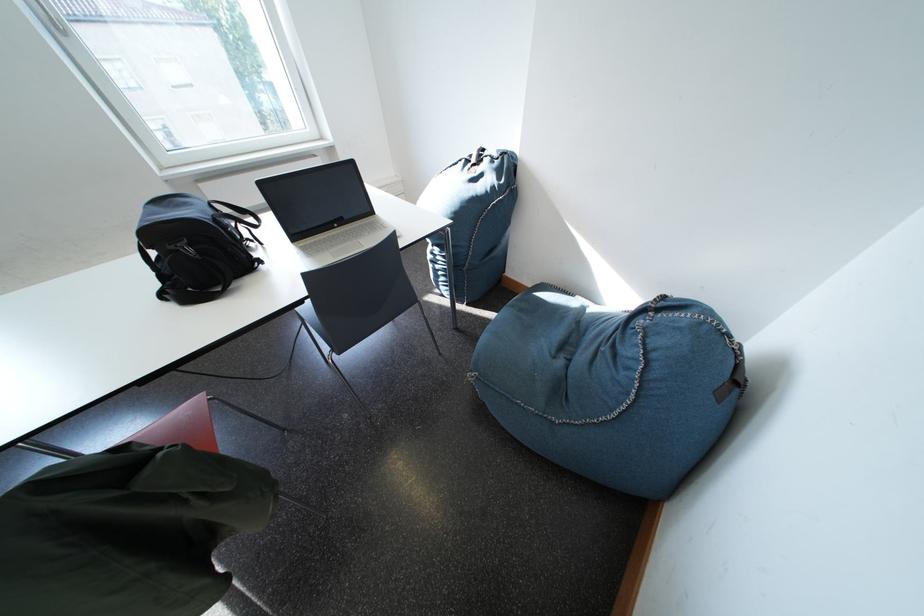
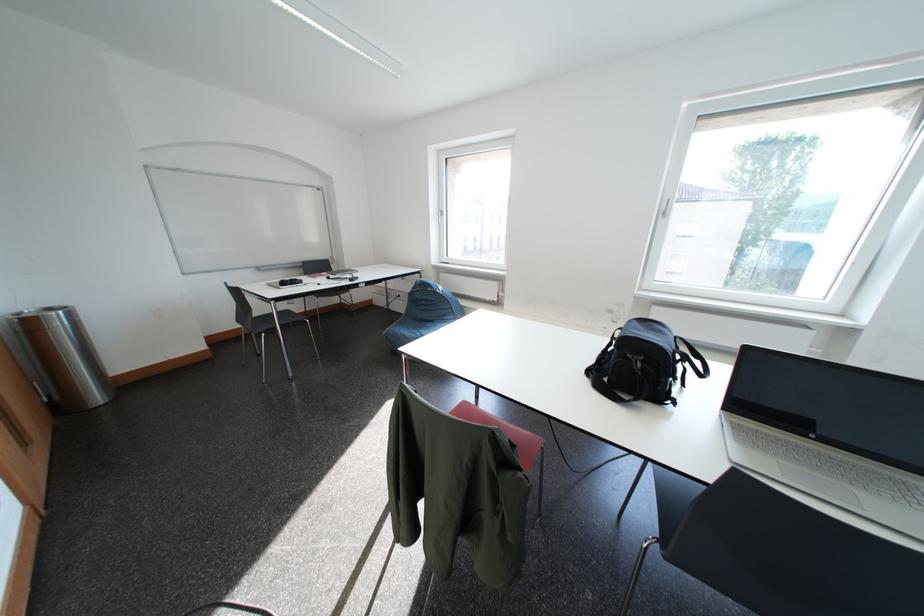
The point at (165,212) is marked in the first image. Where is the corresponding point in the second image?

(648, 326)